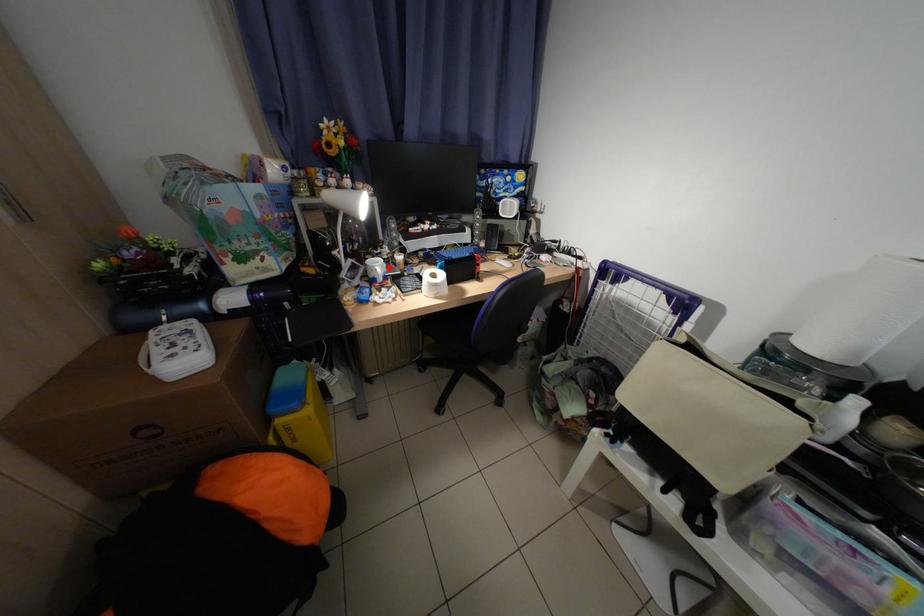
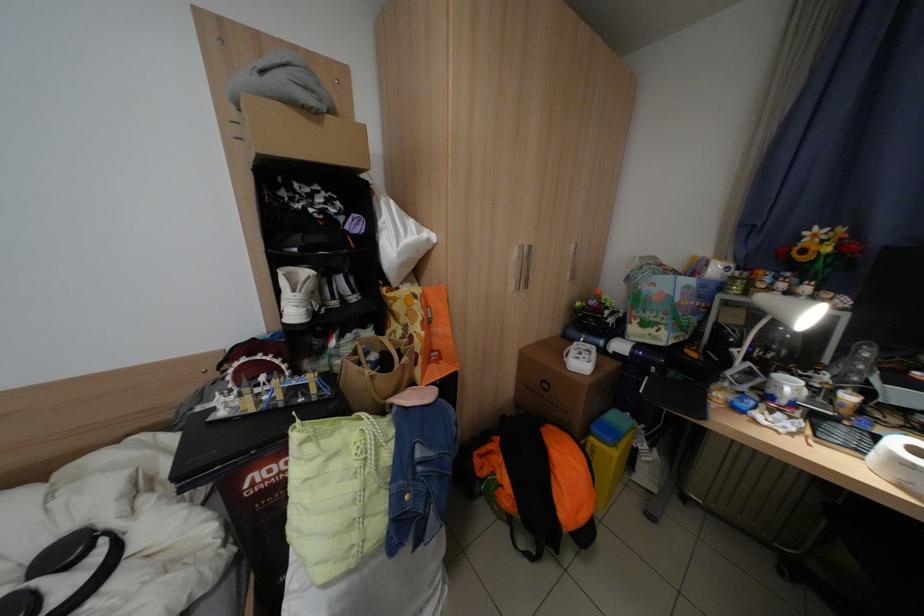
Question: I am providing you with two images of the same scene from different viewpoints. A red point is marked on the first image. Can you still see the location of the red point in image 2?

Choices:
 (A) Yes
 (B) No

Answer: (A)